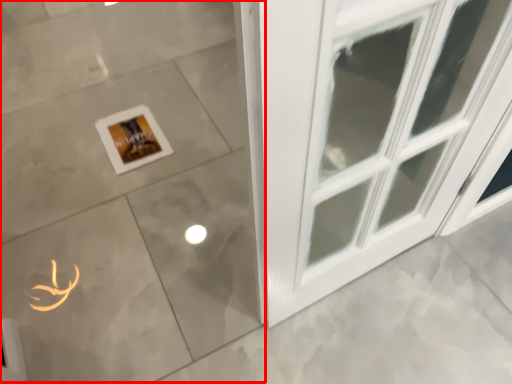
Question: From the image's perspective, where is ceramic tile (annotated by the red box) located in relation to picture frame in the image?

Choices:
 (A) above
 (B) below

Answer: (A)